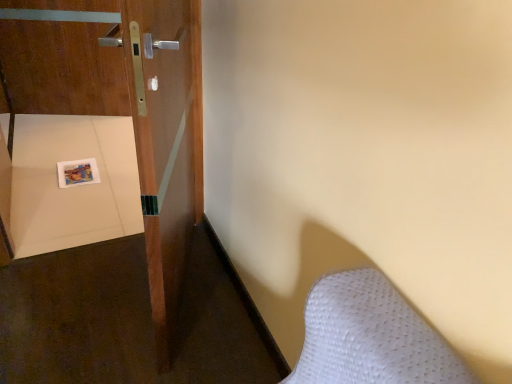
The image size is (512, 384). I want to click on vacant space situated above matte plastic tray at lower left (from a real-world perspective), so click(x=80, y=169).